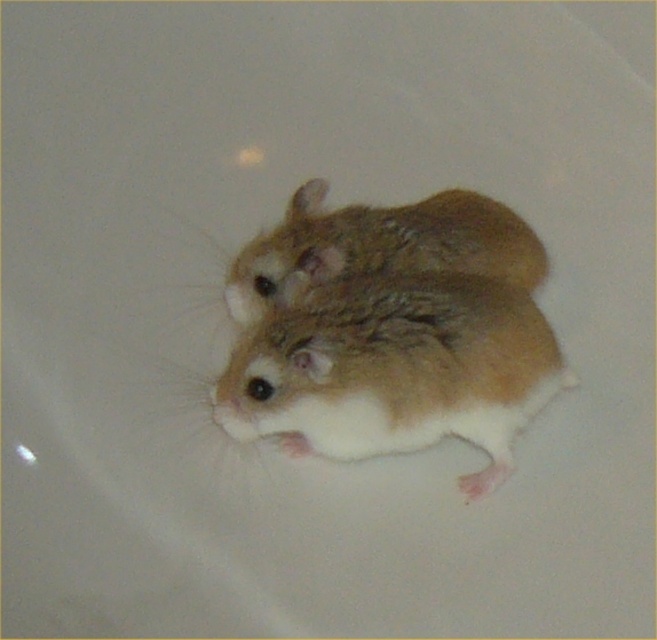
Between fuzzy brown mouse at center and fuzzy brown hamster at center, which one is positioned higher?

fuzzy brown hamster at center

Who is more distant from viewer, (512, 330) or (279, 305)?

Positioned behind is point (279, 305).

Locate an element on the screen. The width and height of the screenshot is (657, 640). fuzzy brown mouse at center is located at coordinates (396, 371).